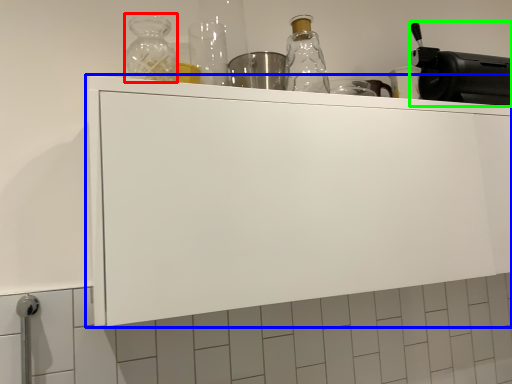
Question: Which object is the farthest from bottle (highlighted by a red box)? Choose among these: cabinetry (highlighted by a blue box) or appliance (highlighted by a green box).

Choices:
 (A) cabinetry
 (B) appliance

Answer: (B)